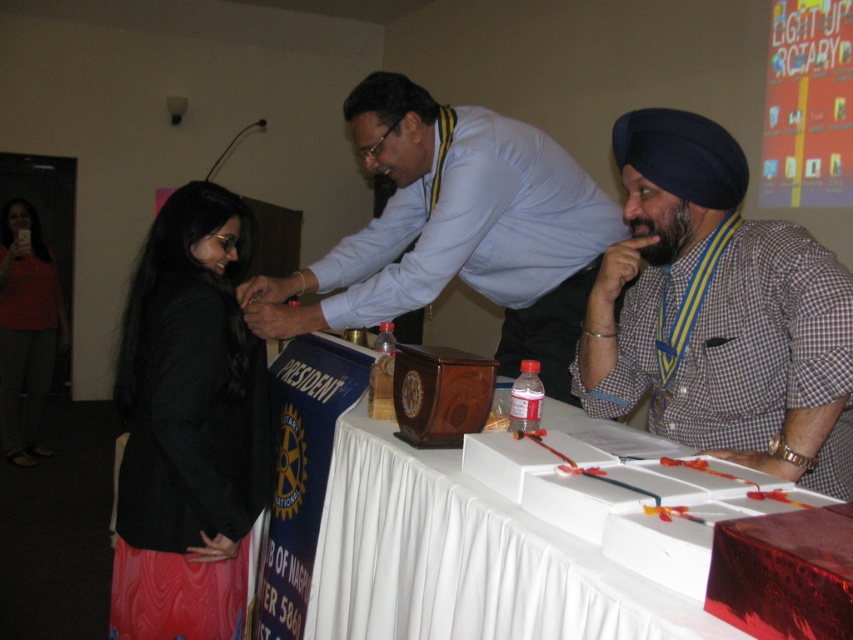
Which of these two, black fabric jacket at left or black shiny hair at upper left, stands shorter?

With less height is black shiny hair at upper left.

Find the location of `black fabric jacket at left`. black fabric jacket at left is located at coordinates (189, 426).

Is point (128, 436) farther from viewer compared to point (13, 202)?

No.

This screenshot has width=853, height=640. Find the location of `black fabric jacket at left`. black fabric jacket at left is located at coordinates (189, 426).

In the scene shown: Does black silky hair at left appear under black shiny hair at upper left?

Correct, black silky hair at left is located below black shiny hair at upper left.

Measure the distance from black silky hair at left to black shiny hair at upper left.

black silky hair at left and black shiny hair at upper left are 3.63 meters apart from each other.

Is point (189, 196) positioned behind point (45, 260)?

No, (189, 196) is closer to viewer.

I want to click on black silky hair at left, so click(x=173, y=262).

Does checkered fabric shirt at center have a greater height compared to black shiny hair at upper left?

Correct, checkered fabric shirt at center is much taller as black shiny hair at upper left.

Who is positioned more to the left, checkered fabric shirt at center or black shiny hair at upper left?

black shiny hair at upper left is more to the left.

Is point (709, 262) positioned before point (4, 243)?

Yes, point (709, 262) is closer to viewer.

You are a GUI agent. You are given a task and a screenshot of the screen. Output one action in this format:
    pyautogui.click(x=<x>, y=<y>)
    Task: Click on the checkered fabric shirt at center
    The width and height of the screenshot is (853, 640).
    Given the screenshot: What is the action you would take?
    pyautogui.click(x=718, y=312)